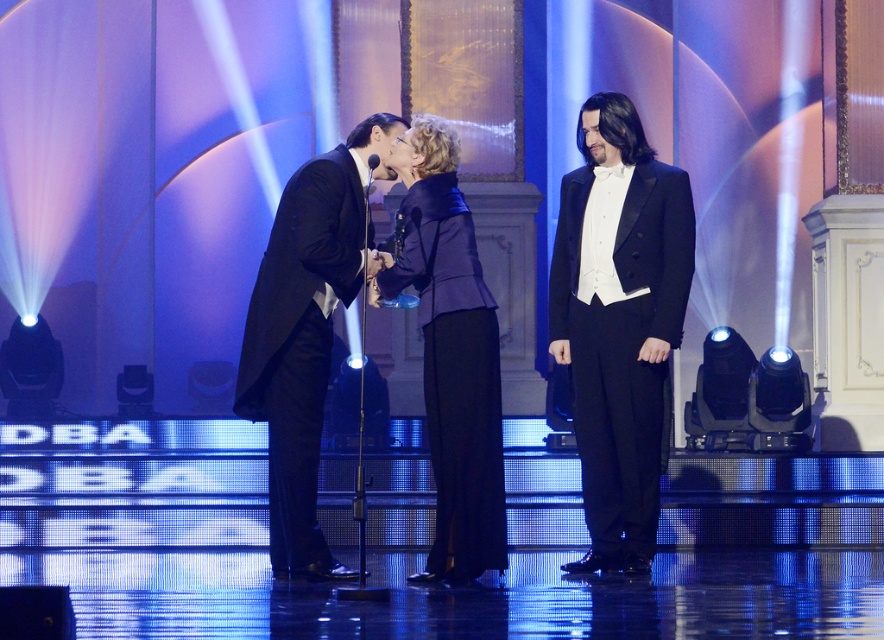
Question: Which point appears farthest from the camera in this image?

Choices:
 (A) (332, 269)
 (B) (471, 547)
 (C) (692, 240)

Answer: (C)

Question: Is black satin tuxedo at right further to camera compared to velvet blue blazer at center?

Choices:
 (A) no
 (B) yes

Answer: (B)

Question: Is black satin tuxedo at right bigger than black satin tuxedo at left?

Choices:
 (A) no
 (B) yes

Answer: (A)

Question: Which of these objects is positioned farthest from the black satin tuxedo at right?

Choices:
 (A) black satin tuxedo at left
 (B) velvet blue blazer at center

Answer: (A)

Question: Which point is closer to the camera taking this photo?

Choices:
 (A) (354, 180)
 (B) (433, 401)

Answer: (B)

Question: Can you confirm if black satin tuxedo at right is bigger than black satin tuxedo at left?

Choices:
 (A) no
 (B) yes

Answer: (A)